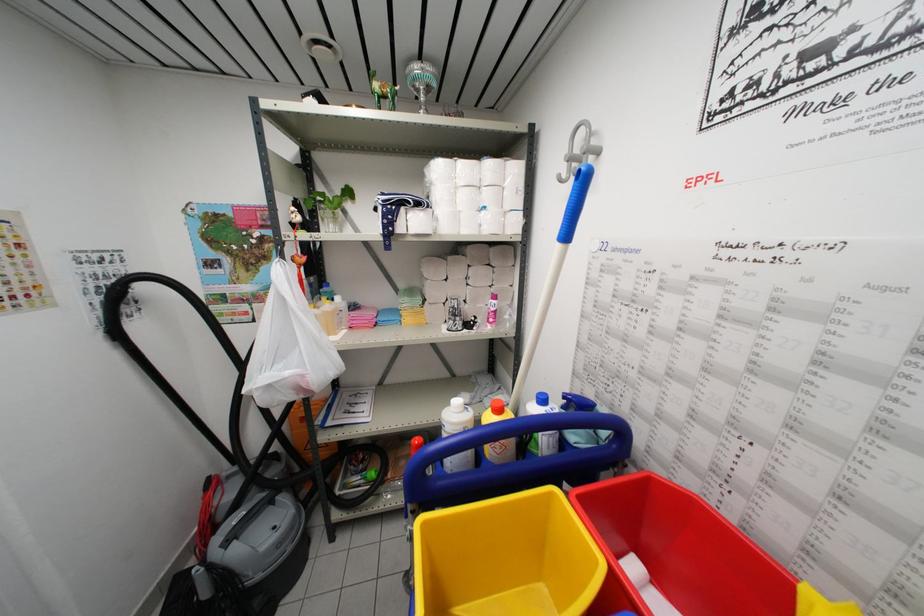
You are a GUI agent. You are given a task and a screenshot of the screen. Output one action in this format:
    pyautogui.click(x=<x>, y=<y>)
    Task: Click on the blue mop handle
    This screenshot has height=616, width=924.
    Given the screenshot: What is the action you would take?
    pyautogui.click(x=580, y=185)